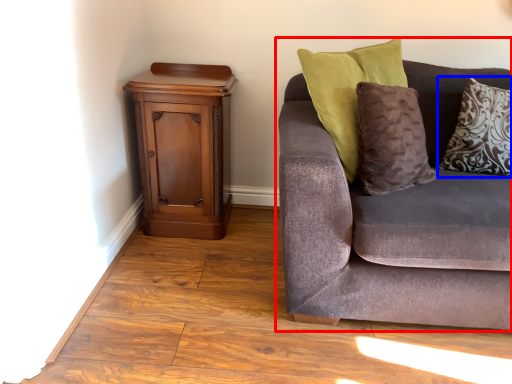
Question: Which object appears closest to the camera in this image, studio couch (highlighted by a red box) or pillow (highlighted by a blue box)?

Choices:
 (A) studio couch
 (B) pillow

Answer: (A)